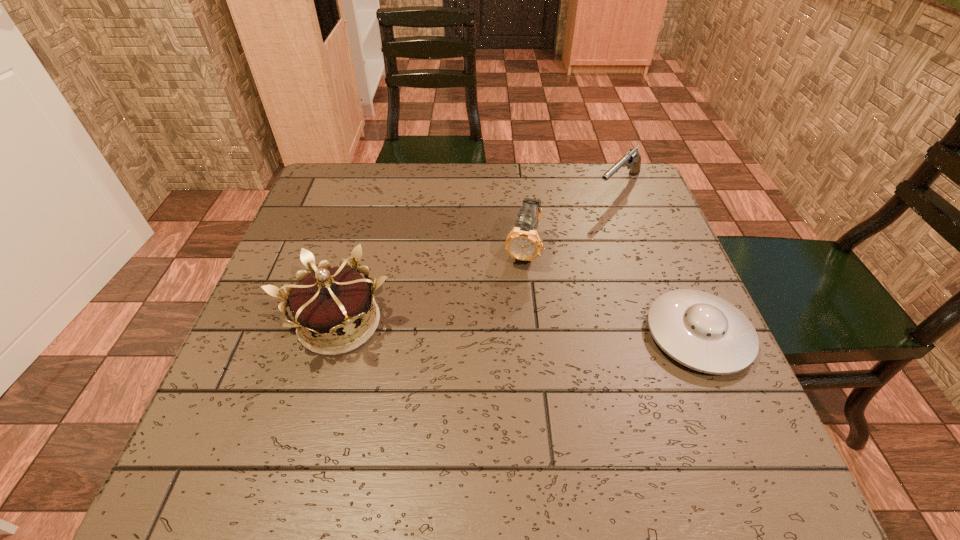
Locate an element on the screen. This screenshot has height=540, width=960. empty location between the crown and the second object from left to right is located at coordinates (431, 287).

The height and width of the screenshot is (540, 960). What are the coordinates of `free space between the farthest object and the leftmost object` in the screenshot? It's located at (479, 255).

Where is `vacant area that lies between the second object from left to right and the shortest object`? vacant area that lies between the second object from left to right and the shortest object is located at coordinates tap(610, 293).

Where is `free space that is in between the shortest object and the second object from left to right`? The image size is (960, 540). free space that is in between the shortest object and the second object from left to right is located at coordinates (610, 293).

Where is `vacant area that lies between the third nearest object and the crown`? vacant area that lies between the third nearest object and the crown is located at coordinates (x=431, y=287).

The image size is (960, 540). I want to click on vacant space that is in between the shortest object and the gun, so click(x=659, y=261).

Find the location of a particular element. The image size is (960, 540). vacant space in between the third tallest object and the saucer is located at coordinates (659, 261).

Locate an element on the screen. The height and width of the screenshot is (540, 960). empty space that is in between the crown and the shortest object is located at coordinates (518, 329).

Point out which object is positioned as the second nearest to the second farthest object. Please provide its 2D coordinates. Your answer should be formatted as a tuple, i.e. [(x, y)], where the tuple contains the x and y coordinates of a point satisfying the conditions above.

[(701, 331)]

This screenshot has width=960, height=540. What are the coordinates of `object that stands as the third closest to the leftmost object` in the screenshot? It's located at (632, 158).